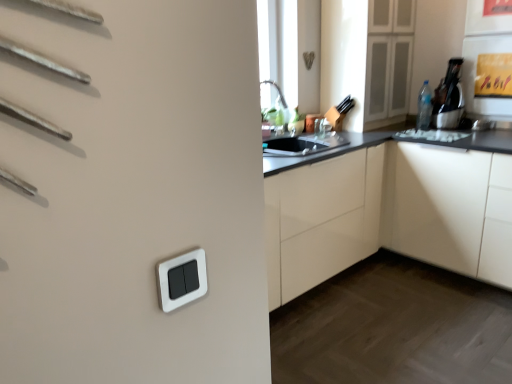
Question: Visually, is silver metallic faucet at upper center positioned to the left or to the right of white plastic light switch at center?

Choices:
 (A) left
 (B) right

Answer: (B)

Question: Is silver metallic faucet at upper center in front of or behind white plastic light switch at center in the image?

Choices:
 (A) behind
 (B) front

Answer: (A)

Question: Estimate the real-world distances between objects in this image. Which object is farther from the white plastic light switch at center?

Choices:
 (A) white glossy cabinet at center, the first cabinetry in the left-to-right sequence
 (B) clear plastic bottle at upper right
 (C) silver metallic faucet at upper center
 (D) matte black kettle at upper right
 (E) white glossy cabinet at center, the third cabinetry when ordered from left to right

Answer: (B)

Question: Estimate the real-world distances between objects in this image. Which object is farther from the white glossy cabinet at upper right, the second cabinetry when ordered from right to left?

Choices:
 (A) clear plastic bottle at upper right
 (B) silver metallic faucet at upper center
 (C) matte black kettle at upper right
 (D) white plastic light switch at center
 (E) white glossy cabinet at center, the first cabinetry in the left-to-right sequence

Answer: (D)